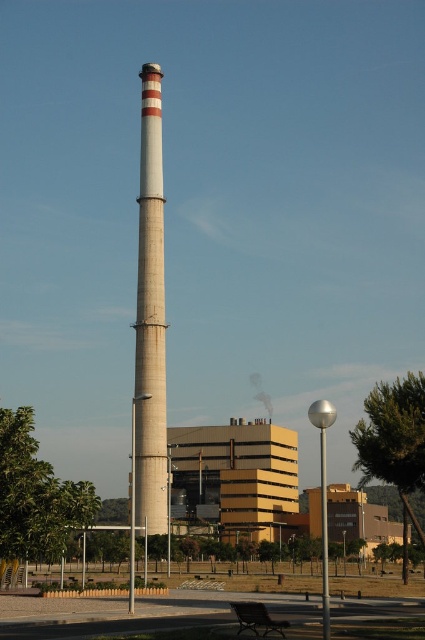
Question: Which point is farther to the camera?

Choices:
 (A) (263, 604)
 (B) (136, 291)

Answer: (B)

Question: Can you confirm if concrete chimney at center is bigger than wooden park bench at lower center?

Choices:
 (A) yes
 (B) no

Answer: (A)

Question: Does concrete chimney at center have a lesser width compared to wooden park bench at lower center?

Choices:
 (A) yes
 (B) no

Answer: (B)

Question: Which of the following is the farthest from the observer?

Choices:
 (A) (283, 628)
 (B) (150, 330)

Answer: (B)

Question: Among these objects, which one is nearest to the camera?

Choices:
 (A) concrete chimney at center
 (B) wooden park bench at lower center

Answer: (B)

Question: Observing the image, what is the correct spatial positioning of concrete chimney at center in reference to wooden park bench at lower center?

Choices:
 (A) left
 (B) right

Answer: (A)